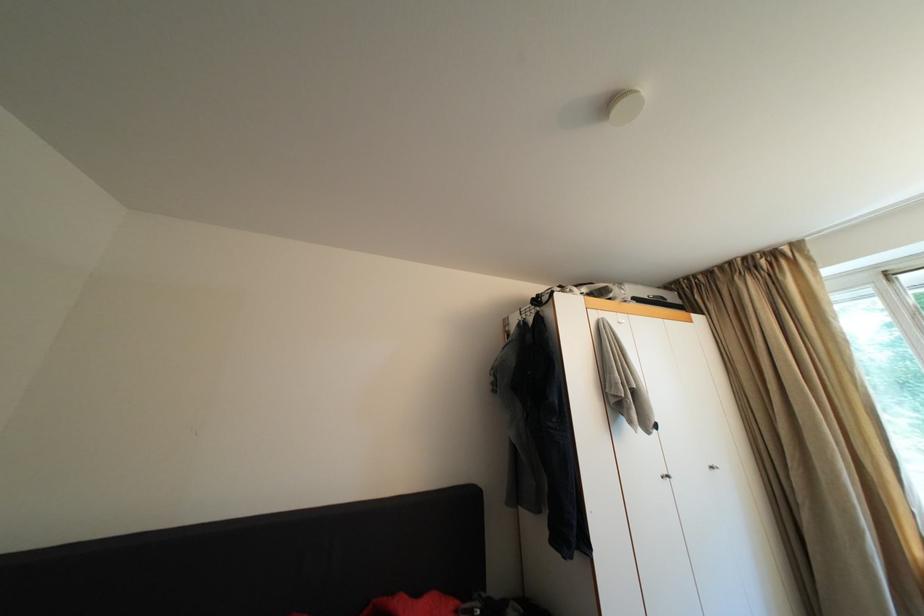
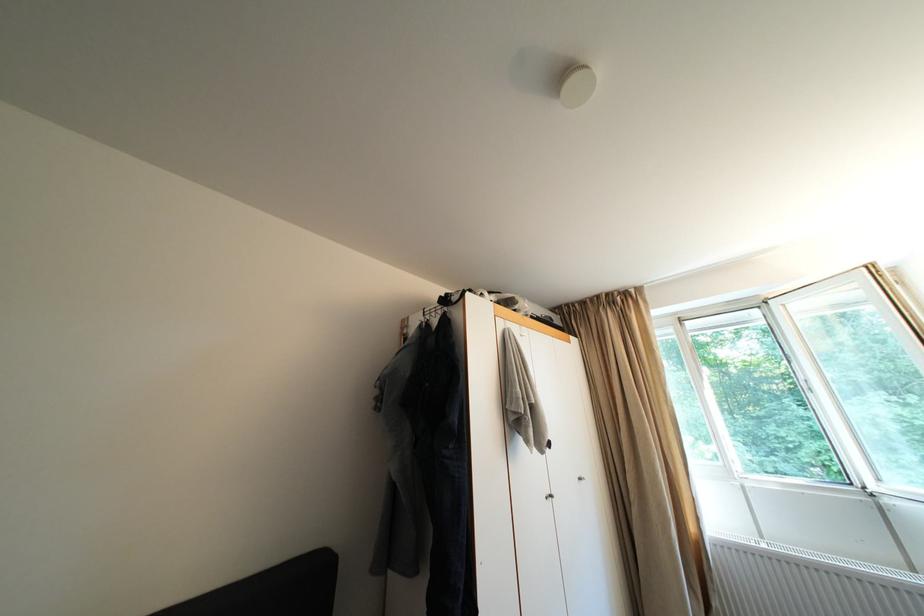
Question: The camera is either moving clockwise (left) or counter-clockwise (right) around the object. The first image is from the beginning of the video and the second image is from the end. Is the camera moving left or right when shooting the video?

Choices:
 (A) Left
 (B) Right

Answer: (A)